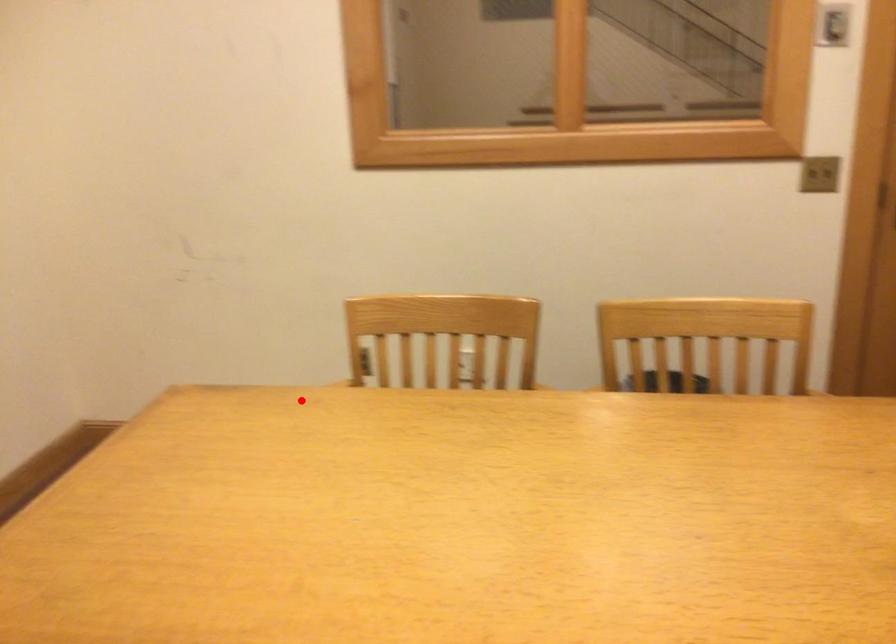
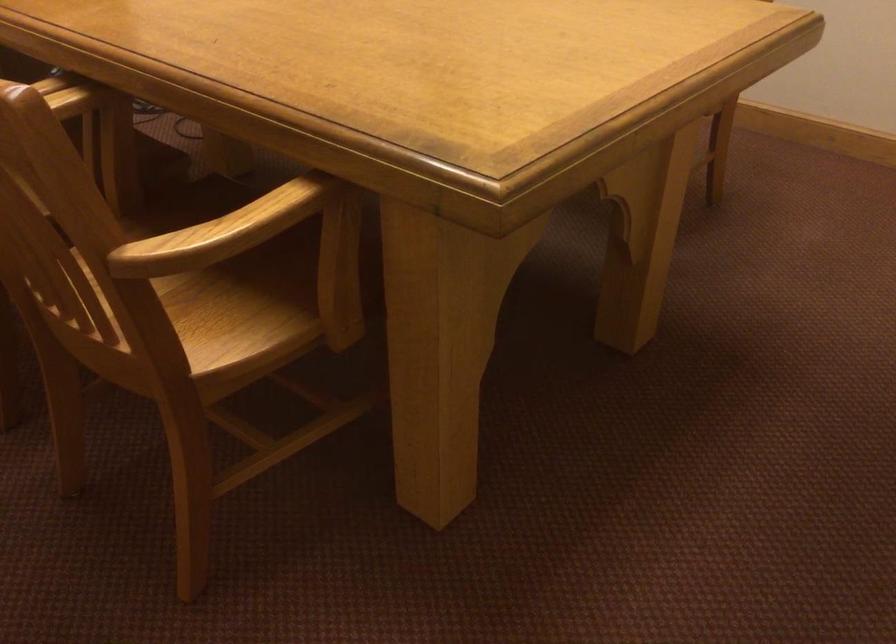
Where in the second image is the point corresponding to the highlighted location from the first image?

(221, 232)